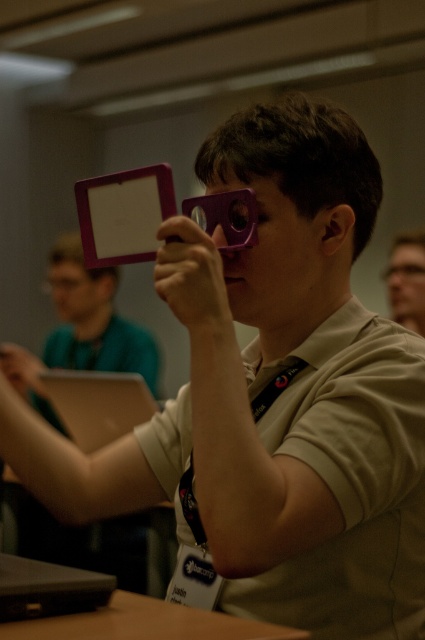
You are standing at the front of the room and see the pink matte tablet at upper center and the matte black glasses at upper center. Which object is closer to you?

The pink matte tablet at upper center is 6.49 feet away from matte black glasses at upper center, so the distance between them is 6.49 feet. However, without knowing their exact positions relative to your location, it is impossible to determine which is closer to you.

You are a photographer setting up for a group photo. You notice two pairs of glasses in the scene, the matte black glasses at upper center and the transparent plastic glasses at upper center. Which pair of glasses is taller?

The matte black glasses at upper center is much taller than the transparent plastic glasses at upper center.

You are an attendee at a conference and you see the pink matte tablet at upper center and the transparent plastic glasses at upper center on a table. Which object is taller?

The transparent plastic glasses at upper center are taller than the pink matte tablet at upper center.